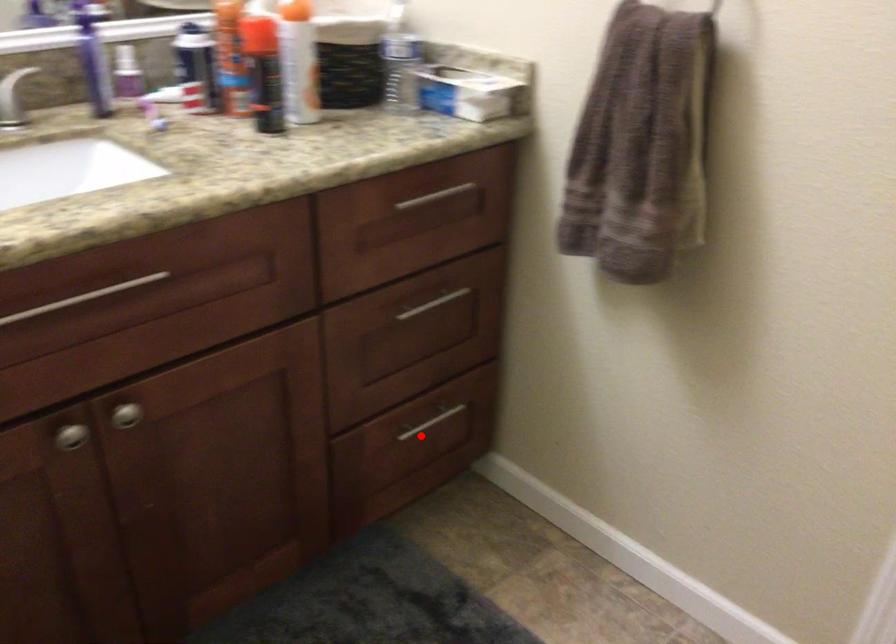
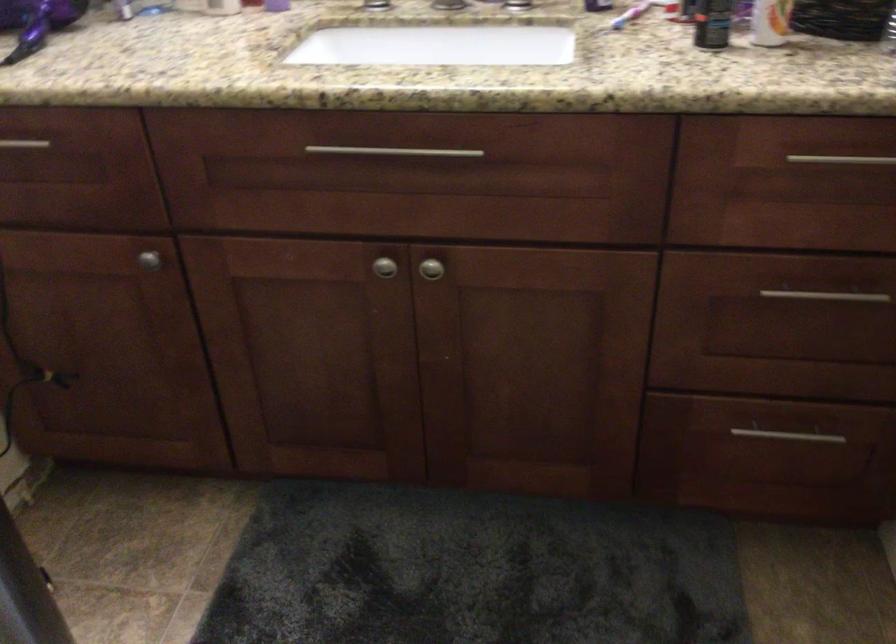
Where in the second image is the point corresponding to the highlighted location from the first image?

(778, 446)